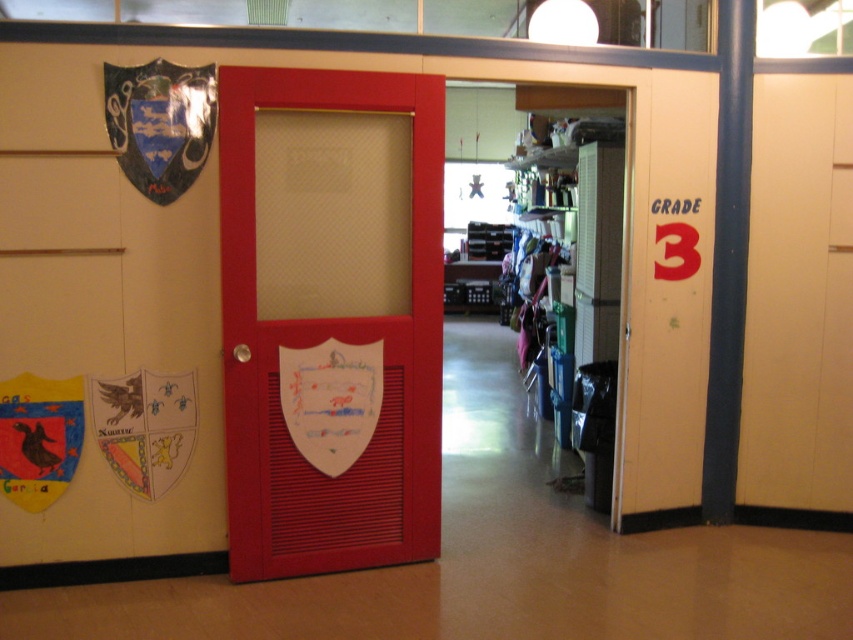
Question: Does matte wood door at center appear on the left side of shiny metallic shield at upper left?

Choices:
 (A) no
 (B) yes

Answer: (A)

Question: Does matte wood door at center have a greater width compared to shiny metallic shield at upper left?

Choices:
 (A) no
 (B) yes

Answer: (B)

Question: Does matte wood door at center appear under shiny metallic shield at upper left?

Choices:
 (A) no
 (B) yes

Answer: (B)

Question: Which object appears farthest from the camera in this image?

Choices:
 (A) matte wood door at center
 (B) shiny metallic shield at upper left

Answer: (B)

Question: Among these points, which one is farthest from the camera?

Choices:
 (A) (170, 125)
 (B) (251, 83)

Answer: (A)